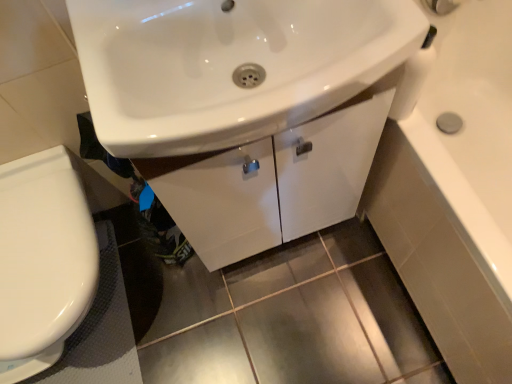
The width and height of the screenshot is (512, 384). I want to click on vacant area located to the right-hand side of black rubber bath mat at lower left, so click(198, 312).